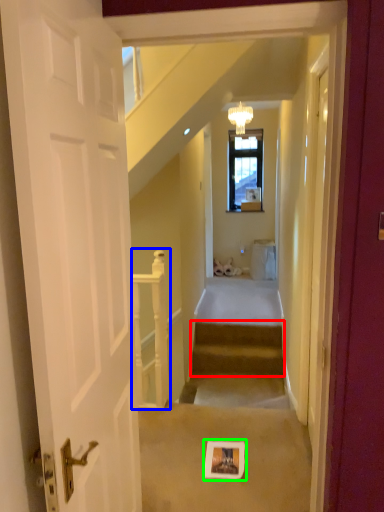
Question: Which object is positioned closest to stairs (highlighted by a red box)? Select from rail (highlighted by a blue box) and picture frame (highlighted by a green box).

Choices:
 (A) rail
 (B) picture frame

Answer: (A)